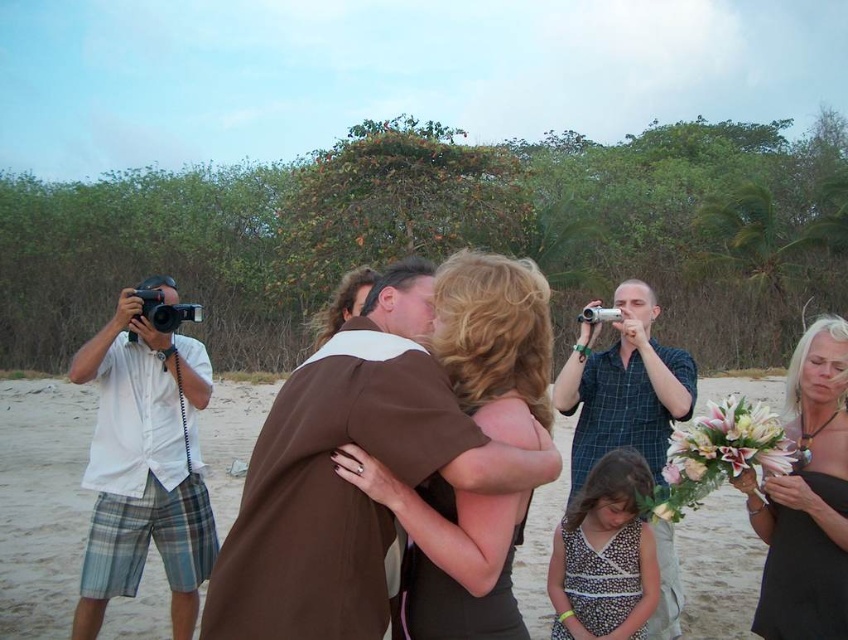
Does point (809, 397) come closer to viewer compared to point (754, 433)?

No, it is not.

Does black satin dress at lower right have a smaller size compared to white floral bouquet at right?

No, black satin dress at lower right is not smaller than white floral bouquet at right.

What do you see at coordinates (806, 497) in the screenshot?
I see `black satin dress at lower right` at bounding box center [806, 497].

The image size is (848, 640). In order to click on black satin dress at lower right in this screenshot , I will do `click(806, 497)`.

Does matte brown dress at center appear on the left side of white floral bouquet at right?

Indeed, matte brown dress at center is positioned on the left side of white floral bouquet at right.

From the picture: Who is higher up, matte brown dress at center or white floral bouquet at right?

Positioned higher is matte brown dress at center.

Does point (523, 384) lie in front of point (662, 496)?

Yes.

You are a GUI agent. You are given a task and a screenshot of the screen. Output one action in this format:
    pyautogui.click(x=<x>, y=<y>)
    Task: Click on the matte brown dress at center
    This screenshot has height=640, width=848.
    Given the screenshot: What is the action you would take?
    pyautogui.click(x=449, y=552)

Is blue plaid shirt at center positioned behind polka dot dress at center?

Yes, it is behind polka dot dress at center.

Who is more distant from viewer, (622, 346) or (583, 636)?

Point (622, 346)

Between point (661, 449) and point (611, 492), which one is positioned behind?

Positioned behind is point (661, 449).

The height and width of the screenshot is (640, 848). What are the coordinates of `blue plaid shirt at center` in the screenshot? It's located at (623, 387).